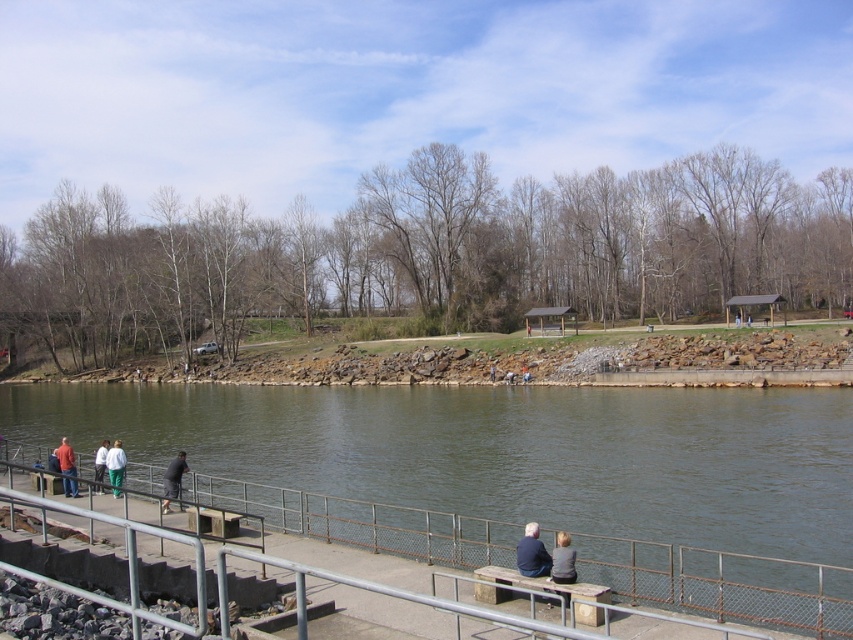
You are standing on the concrete walkway and want to greet the person wearing the dark blue jacket at lower right and the dark gray fabric jacket at lower center. Which person should you approach first to reach them in the shortest path?

You should approach the dark blue jacket at lower right first because it is closer to you than the dark gray fabric jacket at lower center, so reaching it requires a shorter path.

Consider the image. You are a photographer trying to capture the perfect shot of the dark gray pants at lower left and the white cotton shirt at lower left. Based on their sizes, which one should you focus on if you want to ensure both are clearly visible in the frame?

The dark gray pants at lower left is smaller than the white cotton shirt at lower left, so focusing on the white cotton shirt at lower left would allow both to be clearly visible since it takes up more space in the frame.